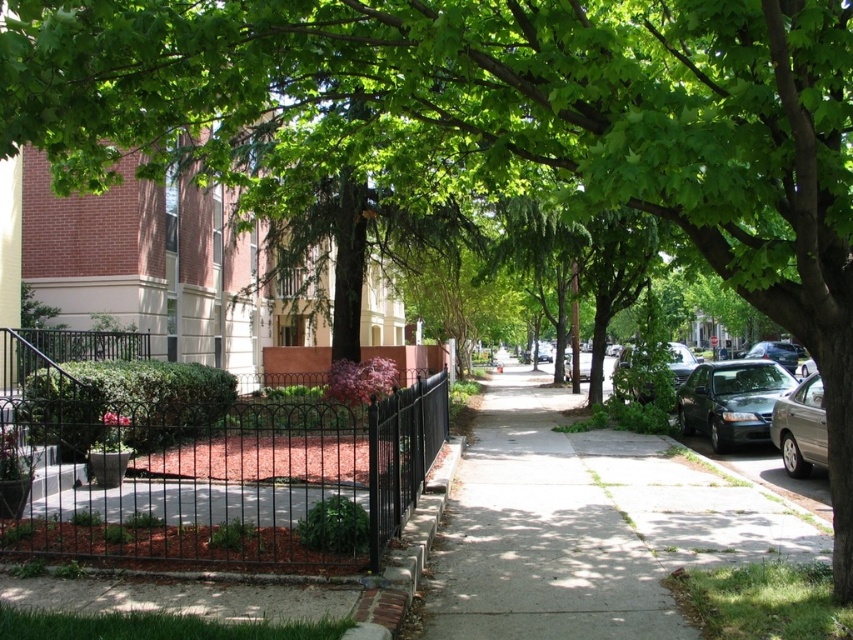
Between shiny black sedan at right and silver metallic sedan at right, which one has more height?

With more height is shiny black sedan at right.

What do you see at coordinates (730, 401) in the screenshot? I see `shiny black sedan at right` at bounding box center [730, 401].

At what (x,y) coordinates should I click in order to perform the action: click on shiny black sedan at right. Please return your answer as a coordinate pair (x, y). Looking at the image, I should click on (730, 401).

Can you confirm if black wrought iron fence at lower left is thinner than smooth concrete sidewalk at center?

Incorrect, black wrought iron fence at lower left's width is not less than smooth concrete sidewalk at center's.

The height and width of the screenshot is (640, 853). What do you see at coordinates (231, 476) in the screenshot?
I see `black wrought iron fence at lower left` at bounding box center [231, 476].

Is point (288, 440) closer to camera compared to point (409, 634)?

No, (288, 440) is further to viewer.

This screenshot has width=853, height=640. What are the coordinates of `black wrought iron fence at lower left` in the screenshot? It's located at (231, 476).

Who is positioned more to the right, black wrought iron fence at lower left or shiny silver sedan at right?

shiny silver sedan at right

In order to click on black wrought iron fence at lower left in this screenshot , I will do `click(231, 476)`.